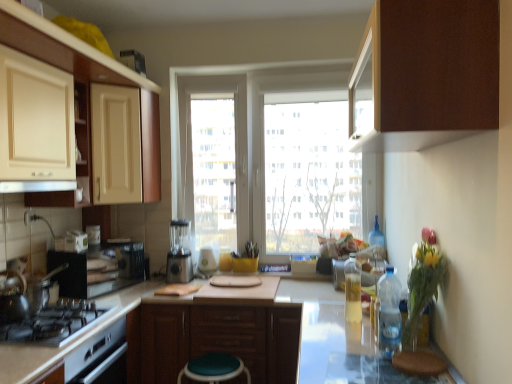
Question: Choose the correct answer: Is brown matte cabinet at upper right, the third cabinetry from the bottom, inside brown matte cabinet at center, which appears as the 3th cabinetry when viewed from the front, or outside it?

Choices:
 (A) outside
 (B) inside

Answer: (A)

Question: Is brown matte cabinet at upper right, acting as the 1th cabinetry starting from the top, to the left or to the right of brown matte cabinet at center, acting as the second cabinetry starting from the left, in the image?

Choices:
 (A) left
 (B) right

Answer: (B)

Question: Estimate the real-world distances between objects in this image. Which object is farther from the matte cream cabinet at upper left, which is the second shelf in right-to-left order?

Choices:
 (A) clear plastic bottle at center, the third bottle from the back
 (B) brown matte cabinet at center, which appears as the 3th cabinetry when viewed from the front
 (C) brown fabric step stool at lower right, the 1th step stool positioned from the front
 (D) white glossy countertop at lower left
 (E) white glossy exhaust hood at upper center

Answer: (C)

Question: Based on their relative distances, which object is nearer to the matte wood shelf at upper left, which is counted as the 1th shelf, starting from the right?

Choices:
 (A) clear plastic bottle at right, marked as the first bottle in a front-to-back arrangement
 (B) shiny metallic tea pot at left
 (C) brown matte cabinet at center, which is counted as the 1th cabinetry, starting from the bottom
 (D) metallic silver blender at center, marked as the 2th appliance in a front-to-back arrangement
 (E) white glossy exhaust hood at upper center

Answer: (E)